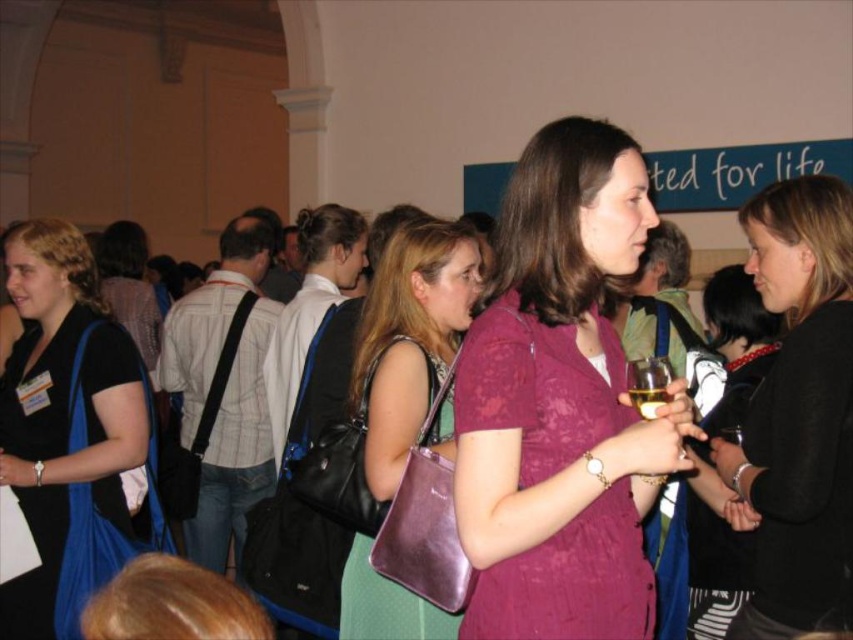
You are at the event and need to carry both purses. Which purse can hold more items, the black fabric purse at left or the shiny purple purse at center?

The black fabric purse at left has a larger size compared to the shiny purple purse at center, so it can hold more items.

You are at a conference and need to choose between placing your keys in either the black fabric purse at left or the shiny purple purse at center. Considering their sizes, which purse can fit the keys more comfortably?

The black fabric purse at left has a larger width than the shiny purple purse at center, so it can fit the keys more comfortably.